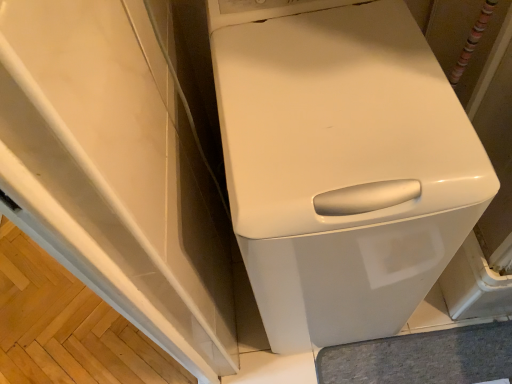
I want to click on white glossy washing machine at center, so click(x=341, y=164).

This screenshot has height=384, width=512. Describe the element at coordinates (341, 164) in the screenshot. I see `white glossy washing machine at center` at that location.

Where is `white glossy washing machine at center`? This screenshot has width=512, height=384. white glossy washing machine at center is located at coordinates (341, 164).